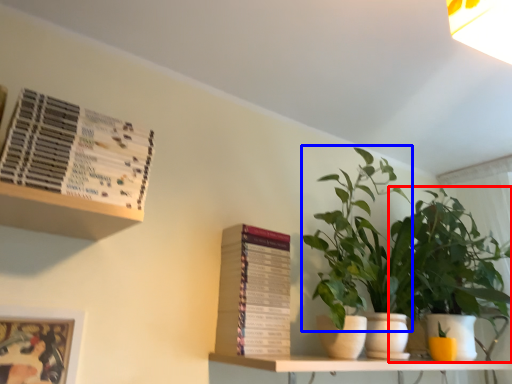
Question: Which object is further to the camera taking this photo, houseplant (highlighted by a red box) or vegetation (highlighted by a blue box)?

Choices:
 (A) houseplant
 (B) vegetation

Answer: (A)